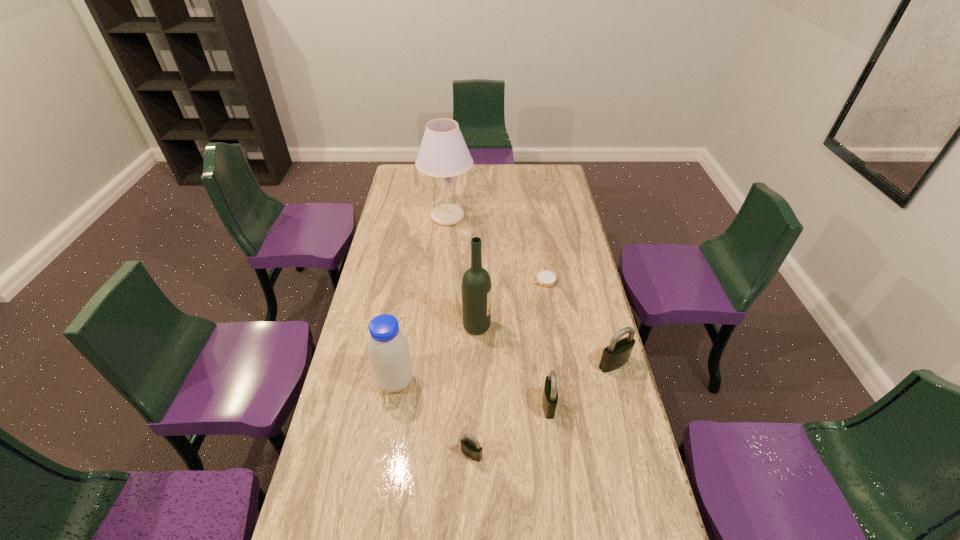
Where is `unoccupied position between the nearest padlock and the rightmost padlock`? unoccupied position between the nearest padlock and the rightmost padlock is located at coordinates (542, 409).

I want to click on free point between the third farthest object and the shortest object, so click(x=510, y=303).

I want to click on free space between the fifth tallest object and the soya milk, so click(472, 393).

Identify which object is located as the sixth nearest to the nearest padlock. Please provide its 2D coordinates. Your answer should be formatted as a tuple, i.e. [(x, y)], where the tuple contains the x and y coordinates of a point satisfying the conditions above.

[(443, 152)]

The height and width of the screenshot is (540, 960). In order to click on object that is the second closest to the third tallest object in this screenshot , I will do `click(471, 448)`.

Identify the location of the second closest padlock to the lampshade. This screenshot has height=540, width=960. (550, 394).

This screenshot has width=960, height=540. What are the coordinates of `the third closest padlock relative to the third tallest object` in the screenshot? It's located at (617, 353).

What are the coordinates of `free region that satisfies the following two spatial constraints: 1. on the back side of the rightmost object; 2. on the right side of the third tallest object` in the screenshot? It's located at (398, 363).

Where is `vacant region that satisfies the following two spatial constraints: 1. on the back side of the rightmost object; 2. on the labeled side of the fifth nearest object`? Image resolution: width=960 pixels, height=540 pixels. vacant region that satisfies the following two spatial constraints: 1. on the back side of the rightmost object; 2. on the labeled side of the fifth nearest object is located at coordinates (604, 326).

This screenshot has width=960, height=540. Identify the location of vacant position in the image that satisfies the following two spatial constraints: 1. on the back side of the third tallest object; 2. on the left side of the farthest object. (422, 217).